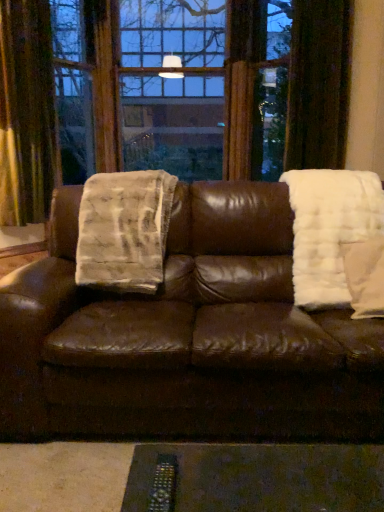
What is the approximate width of white fluffy pillow at right?

13.94 inches.

The height and width of the screenshot is (512, 384). What are the coordinates of `white fluffy pillow at right` in the screenshot? It's located at (365, 276).

This screenshot has width=384, height=512. What are the coordinates of `white furry blanket at left, marked as the 1th blanket in a left-to-right arrangement` in the screenshot? It's located at (124, 230).

This screenshot has height=512, width=384. What do you see at coordinates (26, 112) in the screenshot?
I see `velvet gold curtain at left` at bounding box center [26, 112].

Where is `white fluffy pillow at right`? This screenshot has width=384, height=512. white fluffy pillow at right is located at coordinates (365, 276).

Is white fluffy pillow at right to the right of brown leather couch at center from the viewer's perspective?

Yes, white fluffy pillow at right is to the right of brown leather couch at center.

Is white fluffy pillow at right positioned with its back to brown leather couch at center?

Yes.

Considering the sizes of objects white fluffy pillow at right and brown leather couch at center in the image provided, who is bigger, white fluffy pillow at right or brown leather couch at center?

With larger size is brown leather couch at center.

From the image's perspective, does brown leather couch at center appear higher than white fluffy blanket at right, acting as the second blanket starting from the left?

No, from the image's perspective, brown leather couch at center is not on top of white fluffy blanket at right, acting as the second blanket starting from the left.

Is brown leather couch at center inside the boundaries of white fluffy blanket at right, the 1th blanket positioned from the right, or outside?

brown leather couch at center is not enclosed by white fluffy blanket at right, the 1th blanket positioned from the right.

Does brown leather couch at center lie behind white fluffy blanket at right, the 1th blanket positioned from the right?

No, brown leather couch at center is closer to the viewer.

In terms of height, does brown leather couch at center look taller or shorter compared to white fluffy blanket at right, the 1th blanket positioned from the right?

In the image, brown leather couch at center appears to be taller than white fluffy blanket at right, the 1th blanket positioned from the right.

Is white fluffy pillow at right located outside white fluffy blanket at right, the 1th blanket positioned from the right?

Actually, white fluffy pillow at right is at least partially inside white fluffy blanket at right, the 1th blanket positioned from the right.

Which is more to the right, white fluffy pillow at right or white fluffy blanket at right, the 1th blanket positioned from the right?

white fluffy pillow at right.

Is white fluffy pillow at right touching white fluffy blanket at right, the 1th blanket positioned from the right?

No.

Is velvet gold curtain at left oriented towards brown leather couch at center?

Yes, velvet gold curtain at left is facing brown leather couch at center.

Is velvet gold curtain at left in front of or behind brown leather couch at center in the image?

Visually, velvet gold curtain at left is located behind brown leather couch at center.

Based on the photo, from their relative heights in the image, would you say velvet gold curtain at left is taller or shorter than brown leather couch at center?

In the image, velvet gold curtain at left appears to be taller than brown leather couch at center.

From a real-world perspective, who is located higher, velvet gold curtain at left or brown leather couch at center?

velvet gold curtain at left.

Is brown leather couch at center facing towards white furry blanket at left, marked as the 1th blanket in a left-to-right arrangement?

Yes.

Is white furry blanket at left, positioned as the second blanket in right-to-left order, a part of brown leather couch at center?

Indeed, white furry blanket at left, positioned as the second blanket in right-to-left order, is located within brown leather couch at center.

From the image's perspective, would you say brown leather couch at center is shown under white furry blanket at left, positioned as the second blanket in right-to-left order?

Correct, brown leather couch at center appears lower than white furry blanket at left, positioned as the second blanket in right-to-left order, in the image.

Between brown leather couch at center and white furry blanket at left, positioned as the second blanket in right-to-left order, which one has larger width?

With larger width is brown leather couch at center.

Relative to velvet gold curtain at left, is white fluffy blanket at right, the 1th blanket positioned from the right, in front or behind?

white fluffy blanket at right, the 1th blanket positioned from the right, is in front of velvet gold curtain at left.

Locate an element on the screen. the 2nd blanket in front of the velvet gold curtain at left is located at coordinates point(329,228).

Is white fluffy blanket at right, the 1th blanket positioned from the right, spatially inside velvet gold curtain at left, or outside of it?

white fluffy blanket at right, the 1th blanket positioned from the right, cannot be found inside velvet gold curtain at left.

Considering the sizes of white fluffy blanket at right, the 1th blanket positioned from the right, and velvet gold curtain at left in the image, is white fluffy blanket at right, the 1th blanket positioned from the right, taller or shorter than velvet gold curtain at left?

white fluffy blanket at right, the 1th blanket positioned from the right, is shorter than velvet gold curtain at left.

From the image's perspective, which is below, white furry blanket at left, marked as the 1th blanket in a left-to-right arrangement, or velvet gold curtain at left?

white furry blanket at left, marked as the 1th blanket in a left-to-right arrangement, appears lower in the image.

Is white furry blanket at left, marked as the 1th blanket in a left-to-right arrangement, aimed at velvet gold curtain at left?

No.

Is white furry blanket at left, marked as the 1th blanket in a left-to-right arrangement, positioned in front of velvet gold curtain at left?

Yes, it is.

Where is `throw pillow above the brown leather couch at center (from a real-world perspective)`? The height and width of the screenshot is (512, 384). throw pillow above the brown leather couch at center (from a real-world perspective) is located at coordinates (365, 276).

The image size is (384, 512). In order to click on studio couch below the white fluffy blanket at right, the 1th blanket positioned from the right (from the image's perspective) in this screenshot , I will do `click(187, 337)`.

When comparing their distances from white fluffy blanket at right, acting as the second blanket starting from the left, does velvet gold curtain at left or brown leather couch at center seem closer?

The object closer to white fluffy blanket at right, acting as the second blanket starting from the left, is brown leather couch at center.

Based on their spatial positions, is brown leather couch at center or white furry blanket at left, marked as the 1th blanket in a left-to-right arrangement, closer to velvet gold curtain at left?

Among the two, white furry blanket at left, marked as the 1th blanket in a left-to-right arrangement, is located nearer to velvet gold curtain at left.

From the image, which object appears to be nearer to white furry blanket at left, marked as the 1th blanket in a left-to-right arrangement, velvet gold curtain at left or brown leather couch at center?

The object closer to white furry blanket at left, marked as the 1th blanket in a left-to-right arrangement, is brown leather couch at center.

From the image, which object appears to be farther from white fluffy pillow at right, white furry blanket at left, positioned as the second blanket in right-to-left order, or velvet gold curtain at left?

The object further to white fluffy pillow at right is velvet gold curtain at left.

Based on the photo, from the image, which object appears to be farther from brown leather couch at center, velvet gold curtain at left or white fluffy blanket at right, the 1th blanket positioned from the right?

velvet gold curtain at left is further to brown leather couch at center.

Looking at the image, which one is located further to brown leather couch at center, white furry blanket at left, positioned as the second blanket in right-to-left order, or white fluffy pillow at right?

white fluffy pillow at right is positioned further to the anchor brown leather couch at center.

Which object lies further to the anchor point white fluffy blanket at right, acting as the second blanket starting from the left, white fluffy pillow at right or white furry blanket at left, positioned as the second blanket in right-to-left order?

white furry blanket at left, positioned as the second blanket in right-to-left order, lies further to white fluffy blanket at right, acting as the second blanket starting from the left, than the other object.

Which object lies further to the anchor point white furry blanket at left, positioned as the second blanket in right-to-left order, velvet gold curtain at left or white fluffy blanket at right, acting as the second blanket starting from the left?

The object further to white furry blanket at left, positioned as the second blanket in right-to-left order, is velvet gold curtain at left.

Locate an element on the screen. blanket between velvet gold curtain at left and white fluffy blanket at right, the 1th blanket positioned from the right is located at coordinates (124, 230).

Image resolution: width=384 pixels, height=512 pixels. I want to click on studio couch between velvet gold curtain at left and white fluffy pillow at right in the horizontal direction, so click(x=187, y=337).

Where is `blanket located between brown leather couch at center and white fluffy pillow at right in the left-right direction`? blanket located between brown leather couch at center and white fluffy pillow at right in the left-right direction is located at coordinates (329, 228).

Image resolution: width=384 pixels, height=512 pixels. Find the location of `blanket between white furry blanket at left, marked as the 1th blanket in a left-to-right arrangement, and white fluffy pillow at right, in the horizontal direction`. blanket between white furry blanket at left, marked as the 1th blanket in a left-to-right arrangement, and white fluffy pillow at right, in the horizontal direction is located at coordinates (329, 228).